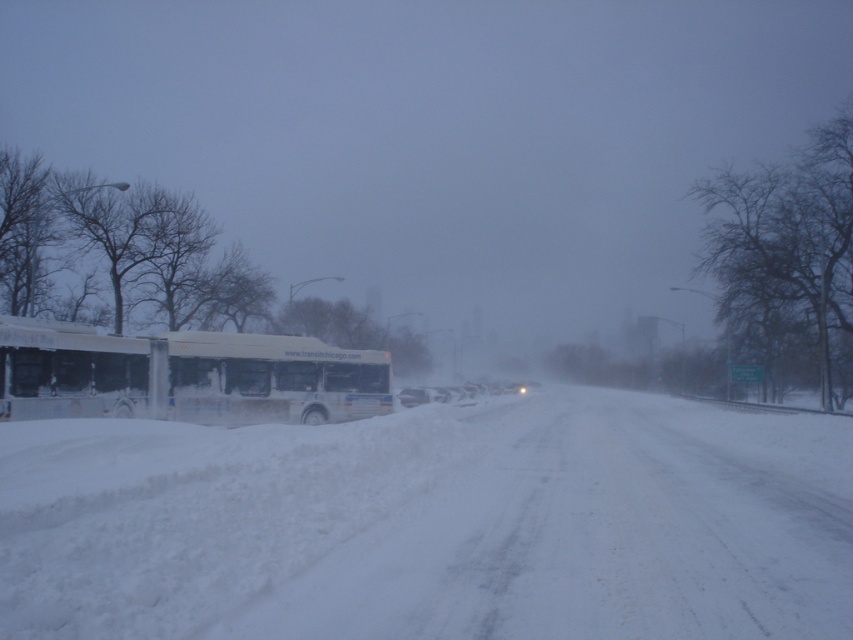
From the picture: You are standing at the point marked by the coordinate point at (433, 524), which is labeled as white fluffy snow at center. Can you see the large white bus parked on the left side of the road from this position?

The point at (433, 524) is labeled as white fluffy snow at center. Since the bus is parked on the left side of the road and the snow at the marked point is at the center, the large white bus on the left side would be visible from this position unless there are obstructions. However, the description does not mention any obstructions, so yes, the large white bus on the left side can be seen from the white fluffy snow at center.